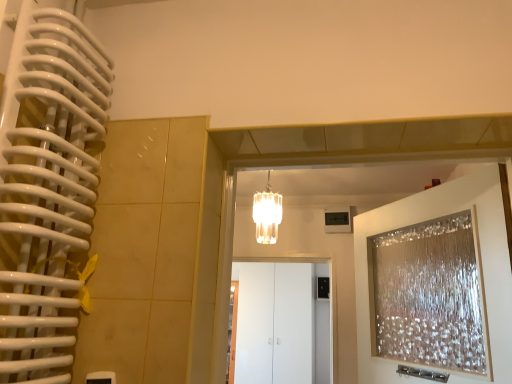
Question: From a real-world perspective, is white glossy cabinet at center over translucent glass chandelier at center?

Choices:
 (A) yes
 (B) no

Answer: (B)

Question: Considering the relative sizes of white glossy cabinet at center and translucent glass chandelier at center in the image provided, is white glossy cabinet at center wider than translucent glass chandelier at center?

Choices:
 (A) no
 (B) yes

Answer: (A)

Question: From the image's perspective, is white glossy cabinet at center located beneath translucent glass chandelier at center?

Choices:
 (A) yes
 (B) no

Answer: (A)

Question: Is white glossy cabinet at center positioned with its back to translucent glass chandelier at center?

Choices:
 (A) no
 (B) yes

Answer: (A)

Question: Can you confirm if white glossy cabinet at center is smaller than translucent glass chandelier at center?

Choices:
 (A) no
 (B) yes

Answer: (A)

Question: Is white glossy cabinet at center bigger than translucent glass chandelier at center?

Choices:
 (A) yes
 (B) no

Answer: (A)

Question: Considering the relative positions of translucent glass door at upper right and translucent glass chandelier at center in the image provided, is translucent glass door at upper right to the left of translucent glass chandelier at center from the viewer's perspective?

Choices:
 (A) yes
 (B) no

Answer: (B)

Question: From a real-world perspective, is translucent glass door at upper right located higher than translucent glass chandelier at center?

Choices:
 (A) no
 (B) yes

Answer: (A)

Question: From the image's perspective, is translucent glass door at upper right located beneath translucent glass chandelier at center?

Choices:
 (A) no
 (B) yes

Answer: (B)

Question: Is translucent glass door at upper right taller than translucent glass chandelier at center?

Choices:
 (A) yes
 (B) no

Answer: (A)

Question: Is translucent glass door at upper right positioned in front of translucent glass chandelier at center?

Choices:
 (A) yes
 (B) no

Answer: (A)

Question: Is translucent glass door at upper right wider than translucent glass chandelier at center?

Choices:
 (A) no
 (B) yes

Answer: (A)

Question: Does translucent glass chandelier at center have a lesser height compared to translucent glass door at upper right?

Choices:
 (A) yes
 (B) no

Answer: (A)